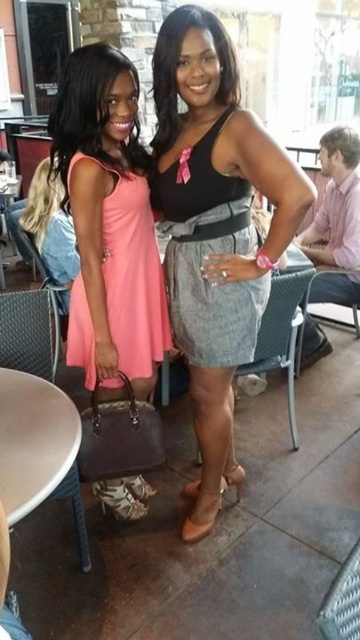
Which is in front, point (150, 212) or point (219, 232)?

Point (219, 232)

Is matte pink dress at center below gray fabric belt at center?

Answer: Yes.

What are the coordinates of `matte pink dress at center` in the screenshot? It's located at (132, 273).

Can you confirm if matte pink dress at center is taller than pink fabric shirt at right?

No, matte pink dress at center is not taller than pink fabric shirt at right.

Is point (140, 216) positioned after point (342, 280)?

No, (140, 216) is in front of (342, 280).

The image size is (360, 640). In order to click on matte pink dress at center in this screenshot , I will do `click(132, 273)`.

Is gray textured dress at center behind pink fabric shirt at right?

That is False.

Measure the distance between gray textured dress at center and camera.

They are 4.88 feet apart.

This screenshot has width=360, height=640. Identify the location of gray textured dress at center. (208, 253).